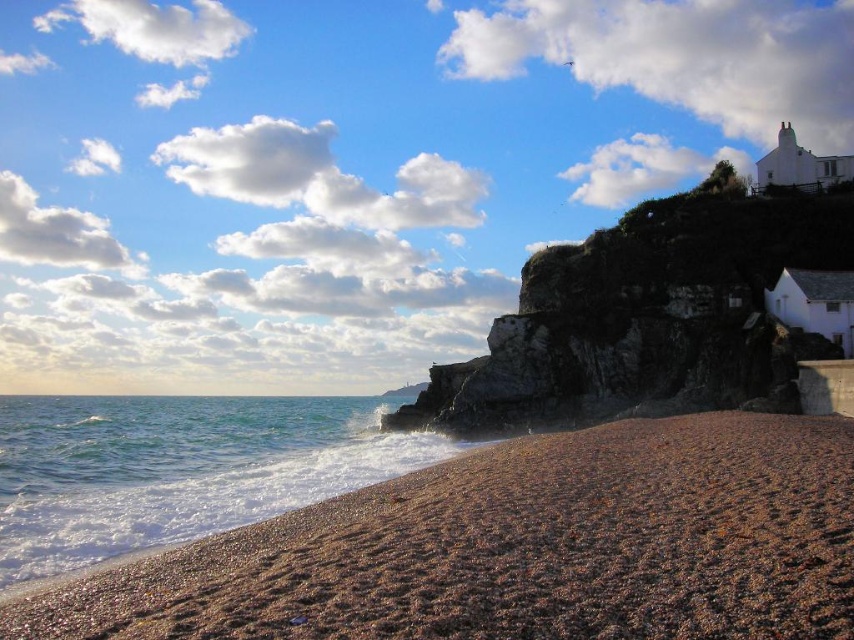
Based on the photo, which is more to the right, brown gravelly sand at lower left or clear water at lower left?

Positioned to the right is brown gravelly sand at lower left.

Is point (839, 612) more distant than point (164, 401)?

No, (839, 612) is closer to viewer.

The height and width of the screenshot is (640, 854). I want to click on brown gravelly sand at lower left, so click(519, 548).

Is brown gravelly sand at lower left positioned before rugged stone cliff at upper right?

Yes, brown gravelly sand at lower left is in front of rugged stone cliff at upper right.

Does brown gravelly sand at lower left have a greater width compared to rugged stone cliff at upper right?

No.

What do you see at coordinates (519, 548) in the screenshot? The image size is (854, 640). I see `brown gravelly sand at lower left` at bounding box center [519, 548].

I want to click on brown gravelly sand at lower left, so click(519, 548).

Is rugged stone cliff at upper right thinner than clear water at lower left?

Correct, rugged stone cliff at upper right's width is less than clear water at lower left's.

Which is behind, point (714, 196) or point (260, 486)?

Point (714, 196)

At what (x,y) coordinates should I click in order to perform the action: click on rugged stone cliff at upper right. Please return your answer as a coordinate pair (x, y). The width and height of the screenshot is (854, 640). Looking at the image, I should click on (648, 316).